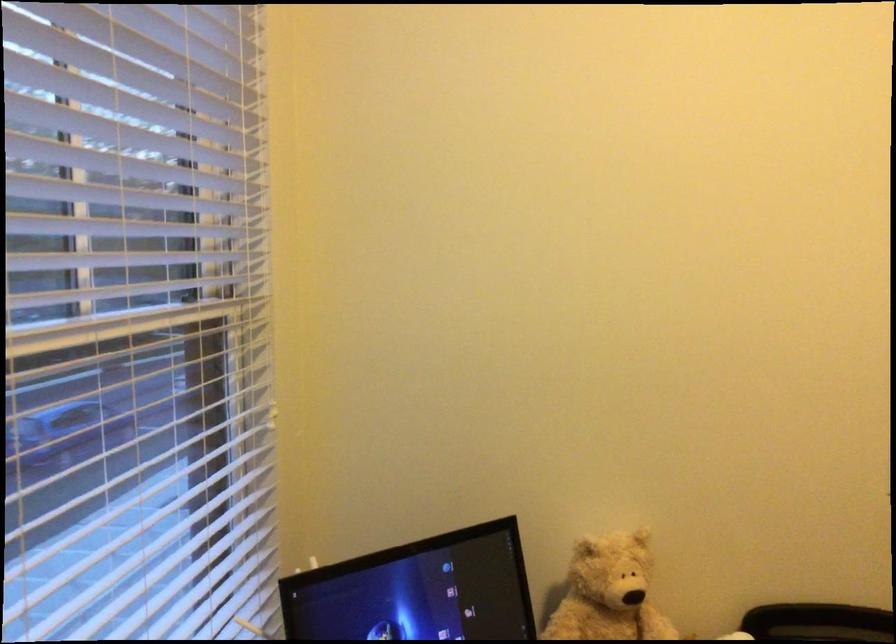
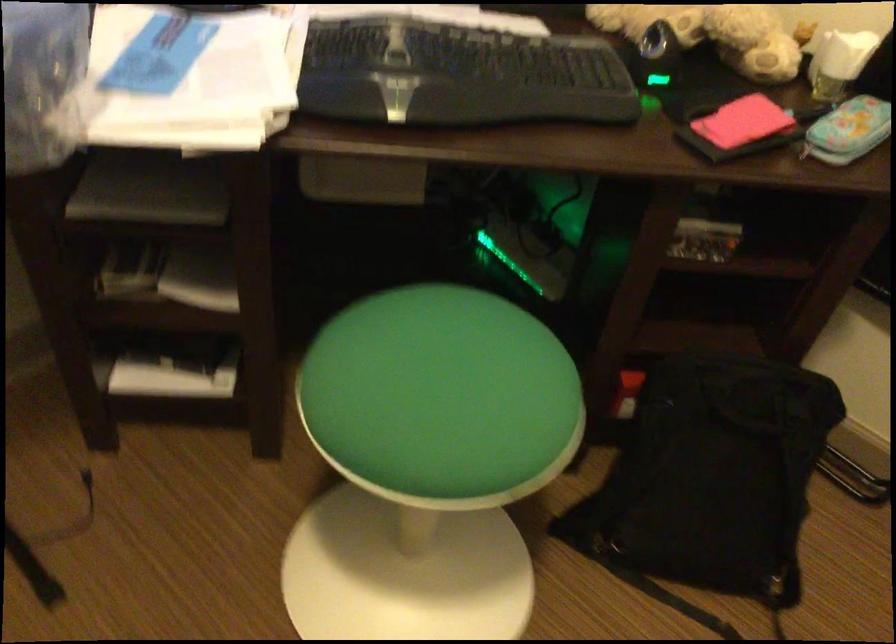
The first image is from the beginning of the video and the second image is from the end. How did the camera likely rotate when shooting the video?

The camera rotated toward left-down.